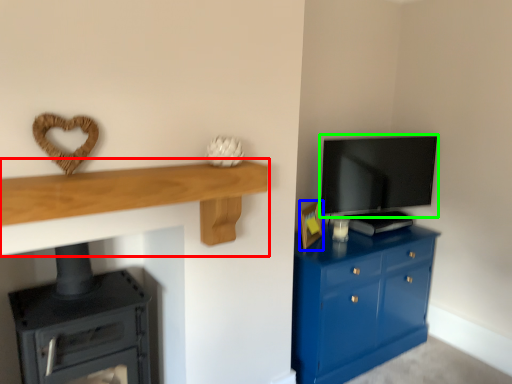
Question: Based on their relative distances, which object is nearer to shelf (highlighted by a red box)? Choose from picture frame (highlighted by a blue box) and television (highlighted by a green box).

Choices:
 (A) picture frame
 (B) television

Answer: (A)